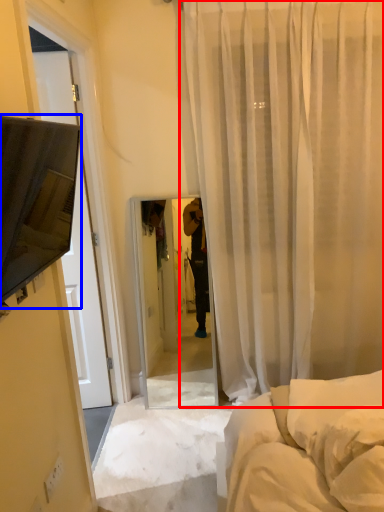
Question: Among these objects, which one is farthest to the camera, curtain (highlighted by a red box) or canopy bed (highlighted by a blue box)?

Choices:
 (A) curtain
 (B) canopy bed

Answer: (A)